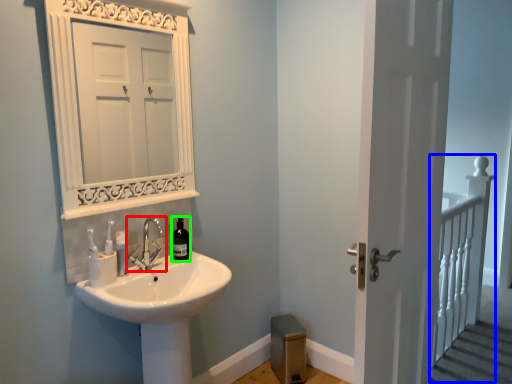
Question: Which object is positioned closest to tap (highlighted by a red box)? Select from rail (highlighted by a blue box) and bottle (highlighted by a green box).

Choices:
 (A) rail
 (B) bottle

Answer: (B)